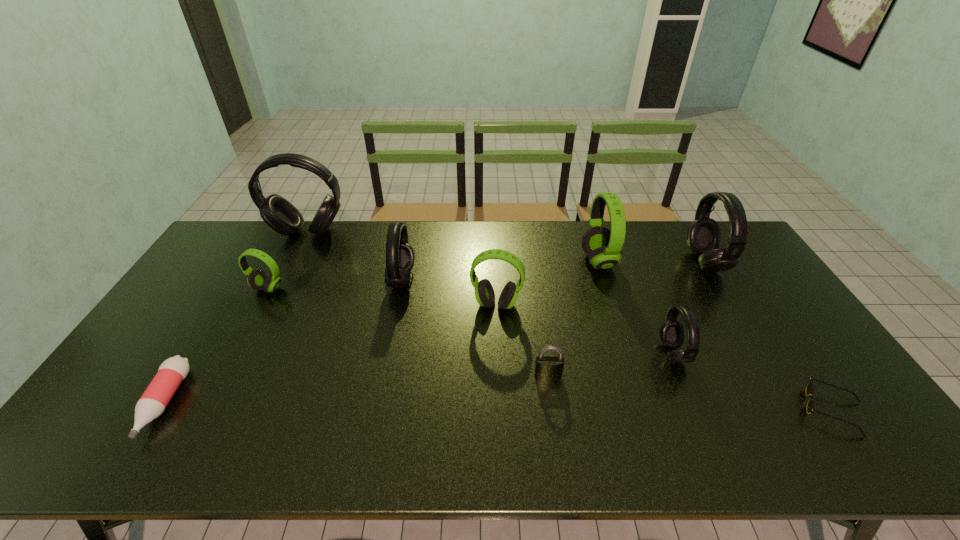
Where is `object that is positioned at the far left corner`? object that is positioned at the far left corner is located at coordinates (278, 213).

I want to click on object situated at the near left corner, so click(x=153, y=402).

Where is `object present at the far right corner`? The image size is (960, 540). object present at the far right corner is located at coordinates (703, 234).

This screenshot has height=540, width=960. I want to click on object located at the near right corner, so click(810, 387).

The image size is (960, 540). Find the location of `free space at the far edge`. free space at the far edge is located at coordinates (622, 249).

Locate an element on the screen. This screenshot has width=960, height=540. vacant space at the near edge of the desktop is located at coordinates (210, 440).

The image size is (960, 540). I want to click on free space at the left edge, so click(209, 307).

At what (x,y) coordinates should I click in order to perform the action: click on vacant space at the right edge of the desktop. Please return your answer as a coordinate pair (x, y). This screenshot has width=960, height=540. Looking at the image, I should click on pos(756,293).

You are a GUI agent. You are given a task and a screenshot of the screen. Output one action in this format:
    pyautogui.click(x=<x>, y=<y>)
    Task: Click on the empty location between the third biggest gray headset and the tallest object
    The image size is (960, 540).
    Given the screenshot: What is the action you would take?
    coord(355,256)

Where is `vacant area that lies between the fifth object from left to right and the sixth headset from left to right`? The width and height of the screenshot is (960, 540). vacant area that lies between the fifth object from left to right and the sixth headset from left to right is located at coordinates (585, 329).